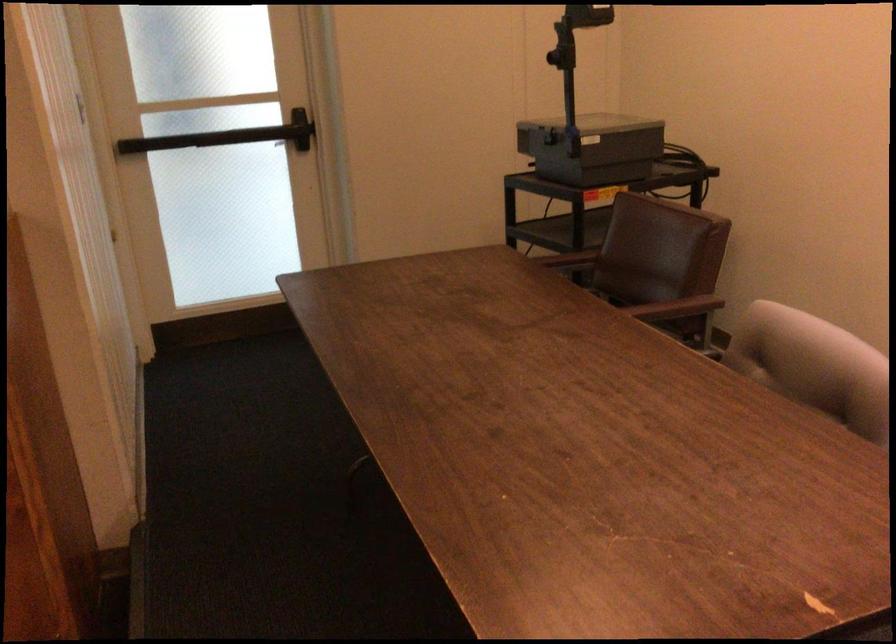
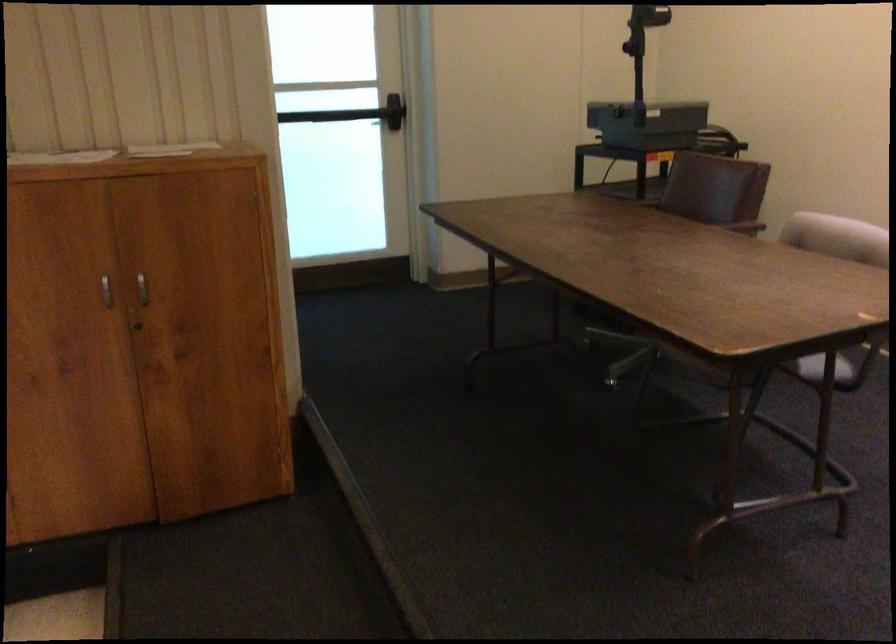
In a continuous first-person perspective shot, in which direction is the camera moving?

The cameraman moved toward left, backward.